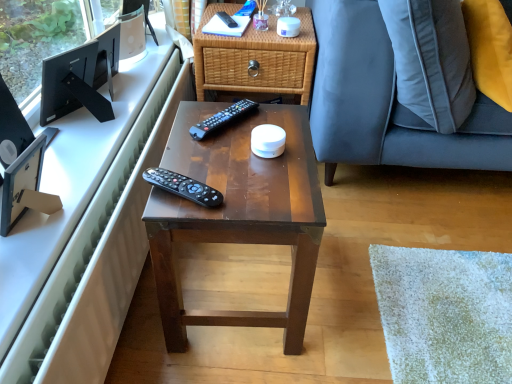
Identify the location of free space in front of black plastic remote control at center, which appears as the second remote control when viewed from the front. This screenshot has height=384, width=512. (227, 158).